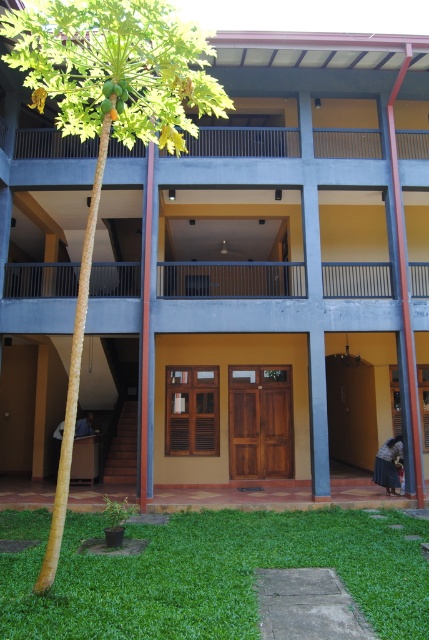
Which is more to the right, black metal balcony at center or brown wooden balcony at upper center?

brown wooden balcony at upper center is more to the right.

Can you confirm if black metal balcony at center is taller than brown wooden balcony at upper center?

Correct, black metal balcony at center is much taller as brown wooden balcony at upper center.

The image size is (429, 640). Describe the element at coordinates (230, 280) in the screenshot. I see `black metal balcony at center` at that location.

Find the location of a particular element. This screenshot has height=640, width=429. black metal balcony at center is located at coordinates (230, 280).

Does green grass at lower center have a larger size compared to black metal balcony at center?

No.

Between point (199, 609) and point (223, 269), which one is positioned in front?

Point (199, 609) is in front.

You are a GUI agent. You are given a task and a screenshot of the screen. Output one action in this format:
    pyautogui.click(x=<x>, y=<y>)
    Task: Click on the green grass at lower center
    
    Given the screenshot: What is the action you would take?
    pyautogui.click(x=210, y=573)

Which of these two, green grass at lower center or green leafy tree at upper left, stands shorter?

green grass at lower center is shorter.

Can you confirm if green grass at lower center is wider than green leafy tree at upper left?

No, green grass at lower center is not wider than green leafy tree at upper left.

Is point (102, 568) less distant than point (29, 58)?

That is False.

Locate an element on the screen. green grass at lower center is located at coordinates (210, 573).